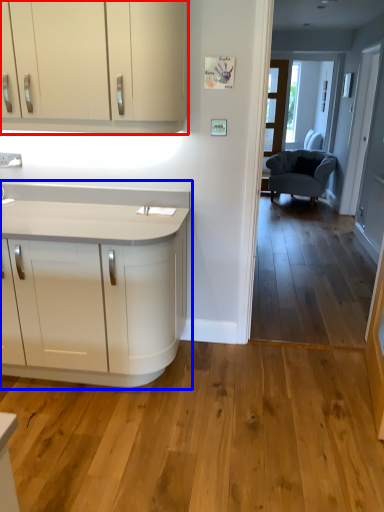
Question: Which object appears farthest to the camera in this image, cabinetry (highlighted by a red box) or countertop (highlighted by a blue box)?

Choices:
 (A) cabinetry
 (B) countertop

Answer: (B)